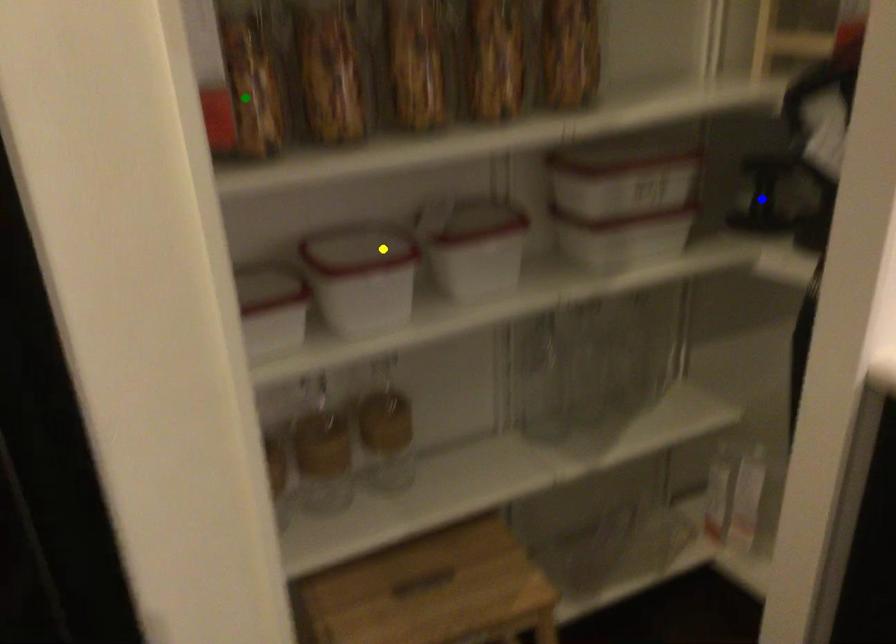
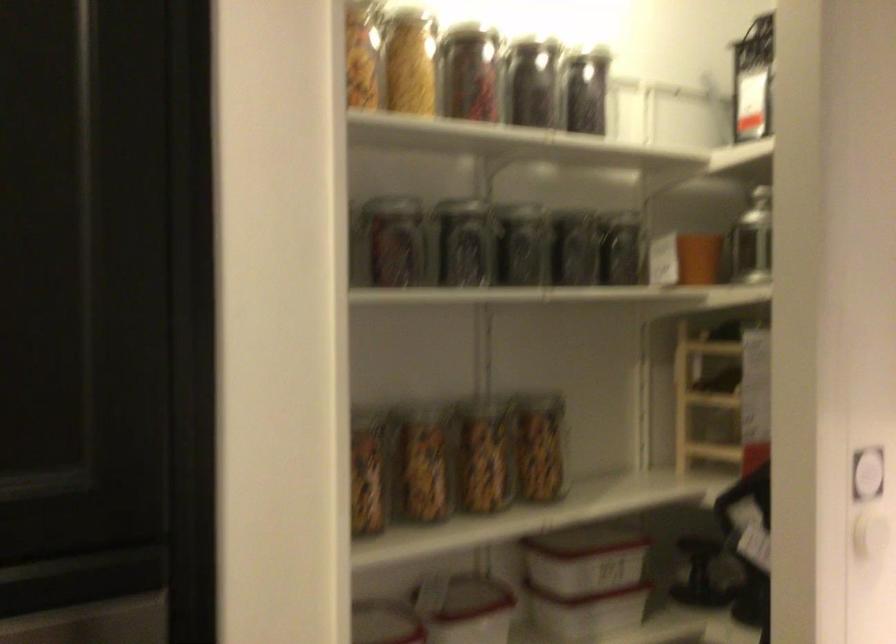
I am providing you with two images of the same scene from different viewpoints. Three points are marked in image1. Which point corresponds to a part or object that is occluded in image2?In image1, three points are marked. Which of them correspond to a part or object that is occluded in image2?Among the three points shown in image1, which one corresponds to a part or object that is no longer visible due to occlusion in image2?

green point